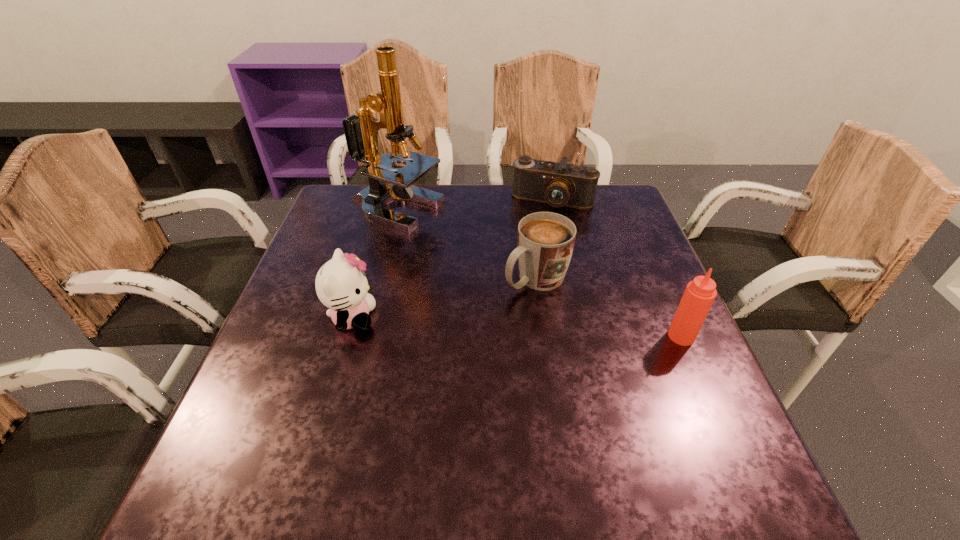
Identify the location of kitten. (341, 285).

This screenshot has width=960, height=540. In order to click on Tabasco sauce in this screenshot , I will do `click(699, 295)`.

Identify the location of mug. The height and width of the screenshot is (540, 960). (545, 240).

At what (x,y) coordinates should I click in order to perform the action: click on microscope. Please return your answer as a coordinate pair (x, y). The image size is (960, 540). Looking at the image, I should click on (361, 132).

Find the location of a particular element. The width and height of the screenshot is (960, 540). camera is located at coordinates (560, 184).

This screenshot has height=540, width=960. Identify the location of vacant space located on the front-facing side of the kitten. (494, 318).

Image resolution: width=960 pixels, height=540 pixels. In order to click on free spot located 0.090m on the back of the rightmost object in this screenshot , I will do `click(664, 297)`.

Find the location of `vacant area located 0.230m on the side of the mug with the handle`. vacant area located 0.230m on the side of the mug with the handle is located at coordinates (436, 347).

The height and width of the screenshot is (540, 960). Identify the location of vacant space situated on the side of the mug with the handle. (475, 320).

Identify the location of free space located on the side of the mug with the handle. coord(417,361).